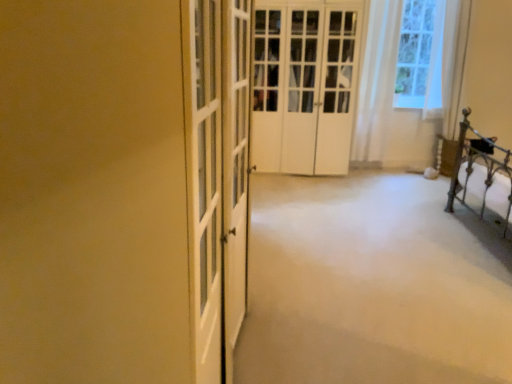
Question: In terms of size, does white sheer curtain at upper right appear bigger or smaller than white matte door at center?

Choices:
 (A) small
 (B) big

Answer: (A)

Question: Is white sheer curtain at upper right inside or outside of white matte door at center?

Choices:
 (A) outside
 (B) inside

Answer: (A)

Question: Based on their relative distances, which object is farther from the white sheer curtain at upper right?

Choices:
 (A) white matte door at center
 (B) white carpet at center

Answer: (B)

Question: Which object is positioned closest to the white sheer curtain at upper right?

Choices:
 (A) white matte door at center
 (B) white carpet at center

Answer: (A)